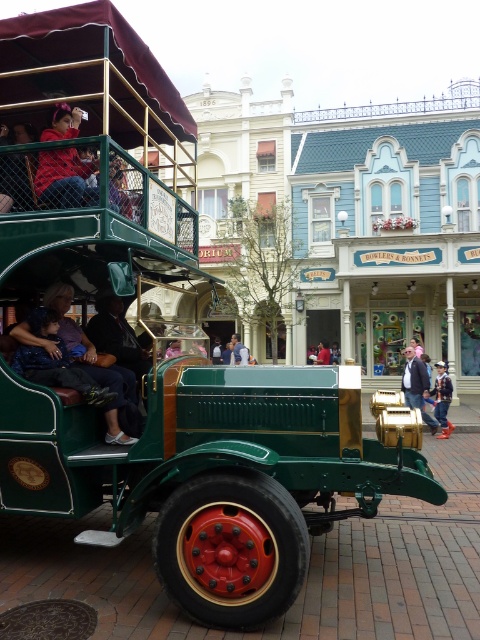
Which is in front, point (84, 186) or point (444, 392)?

Point (84, 186) is more forward.

Which is in front, point (64, 164) or point (446, 429)?

Point (64, 164) is in front.

Where is `matte red jacket at upper left`? The image size is (480, 640). matte red jacket at upper left is located at coordinates (62, 177).

Is matte green jacket at left smaller than matte red jacket at upper left?

No.

Is point (68, 296) behind point (72, 204)?

Yes, point (68, 296) is behind point (72, 204).

You are a GUI agent. You are given a task and a screenshot of the screen. Output one action in this format:
    pyautogui.click(x=<x>, y=<y>)
    Task: Click on the matte green jacket at left
    This screenshot has height=640, width=480.
    Given the screenshot: What is the action you would take?
    pyautogui.click(x=96, y=369)

You are a GUI agent. You are given a task and a screenshot of the screen. Output one action in this format:
    pyautogui.click(x=<x>, y=<y>)
    Task: Click on the matte green jacket at left
    The image size is (480, 640).
    Given the screenshot: What is the action you would take?
    pyautogui.click(x=96, y=369)

Can you confirm if matte green jacket at left is positioned below red shirt at center?

Incorrect, matte green jacket at left is not positioned below red shirt at center.

Looking at this image, is the position of matte green jacket at left more distant than that of red shirt at center?

No, matte green jacket at left is in front of red shirt at center.

Locate an element on the screen. matte green jacket at left is located at coordinates (96, 369).